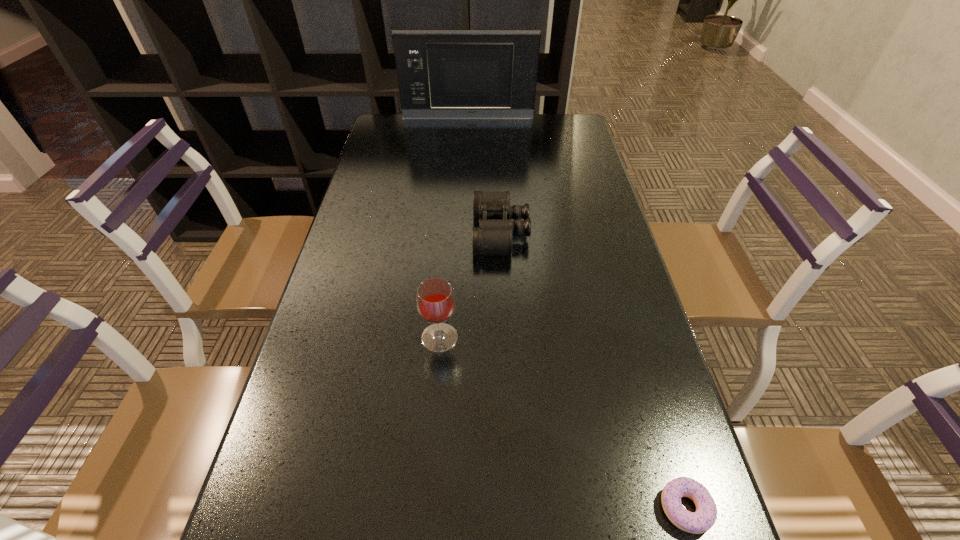
I want to click on unoccupied area between the farthest object and the binoculars, so click(485, 175).

Find the location of `free space between the second tallest object and the tallest object`. free space between the second tallest object and the tallest object is located at coordinates (454, 228).

Find the location of `the closest object relative to the third nearest object`. the closest object relative to the third nearest object is located at coordinates (435, 299).

Identify the location of object that is the third closest to the second tallest object. (442, 74).

Image resolution: width=960 pixels, height=540 pixels. In order to click on vacant space that satisfies the following two spatial constraints: 1. at the eyepieces of the third nearest object; 2. on the right side of the rightmost object in this screenshot , I will do `click(515, 508)`.

Find the location of a particular element. vacant area in the image that satisfies the following two spatial constraints: 1. at the eyepieces of the rightmost object; 2. on the left side of the binoculars is located at coordinates (515, 508).

Locate an element on the screen. This screenshot has height=540, width=960. vacant point that satisfies the following two spatial constraints: 1. at the eyepieces of the binoculars; 2. on the front side of the third shortest object is located at coordinates (506, 338).